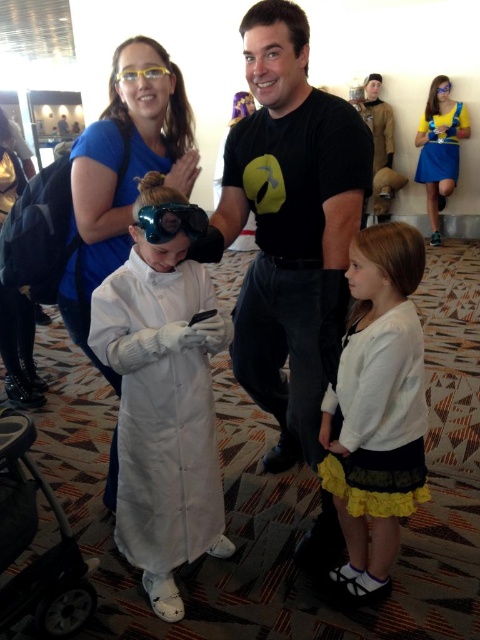
Can you confirm if white matte lab coat at center is positioned to the left of black plastic baby carriage at lower left?

No, white matte lab coat at center is not to the left of black plastic baby carriage at lower left.

Locate an element on the screen. white matte lab coat at center is located at coordinates (163, 396).

The image size is (480, 640). In order to click on white matte lab coat at center in this screenshot , I will do `click(163, 396)`.

This screenshot has height=640, width=480. What are the coordinates of `white matte lab coat at center` in the screenshot? It's located at (163, 396).

Between point (415, 360) and point (432, 138), which one is positioned behind?

The point (432, 138) is more distant.

Measure the distance between white soft sweater at center and blue satin dress at upper right.

The distance of white soft sweater at center from blue satin dress at upper right is 4.70 meters.

Describe the element at coordinates (377, 406) in the screenshot. This screenshot has width=480, height=640. I see `white soft sweater at center` at that location.

Where is `white soft sweater at center`? white soft sweater at center is located at coordinates (377, 406).

Who is taller, white matte lab coat at center or blue satin dress at upper right?

white matte lab coat at center

Which is above, white matte lab coat at center or blue satin dress at upper right?

blue satin dress at upper right

Which is behind, point (123, 422) or point (421, 129)?

The point (421, 129) is behind.

The width and height of the screenshot is (480, 640). Find the location of `white matte lab coat at center`. white matte lab coat at center is located at coordinates (163, 396).